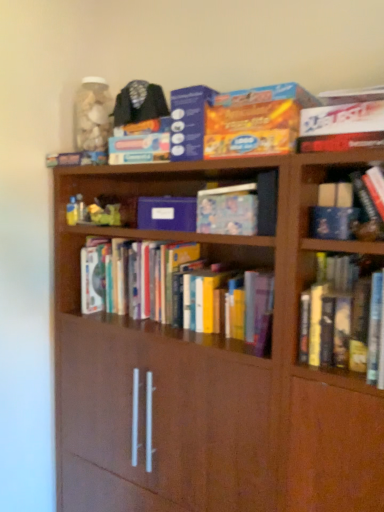
Question: Is point (192, 124) positioned closer to the camera than point (269, 232)?

Choices:
 (A) farther
 (B) closer

Answer: (A)

Question: Based on their sizes in the image, would you say matte cardboard box at upper center, positioned as the 3th paperback book in bottom-to-top order, is bigger or smaller than matte blue book at center, the first book in the top-to-bottom sequence?

Choices:
 (A) small
 (B) big

Answer: (B)

Question: Considering the real-world distances, which object is closest to the brown wood bookcase at center?

Choices:
 (A) matte blue book at center, the first book in the top-to-bottom sequence
 (B) matte cardboard box at upper center, the second paperback book ordered from the bottom
 (C) hardcover books at center, acting as the second book starting from the top
 (D) blue matte paper at center, the 1th paperback book positioned from the bottom
 (E) matte cardboard box at upper center, which appears as the first paperback book when viewed from the top

Answer: (C)

Question: Which of these objects is positioned farthest from the blue matte paper at center, which is the 3th paperback book from top to bottom?

Choices:
 (A) hardcover books at center, acting as the second book starting from the top
 (B) matte cardboard box at upper center, the 2th paperback book when ordered from top to bottom
 (C) matte cardboard box at upper center, which appears as the first paperback book when viewed from the top
 (D) brown wood bookcase at center
 (E) matte blue book at center, the first book in the top-to-bottom sequence

Answer: (D)